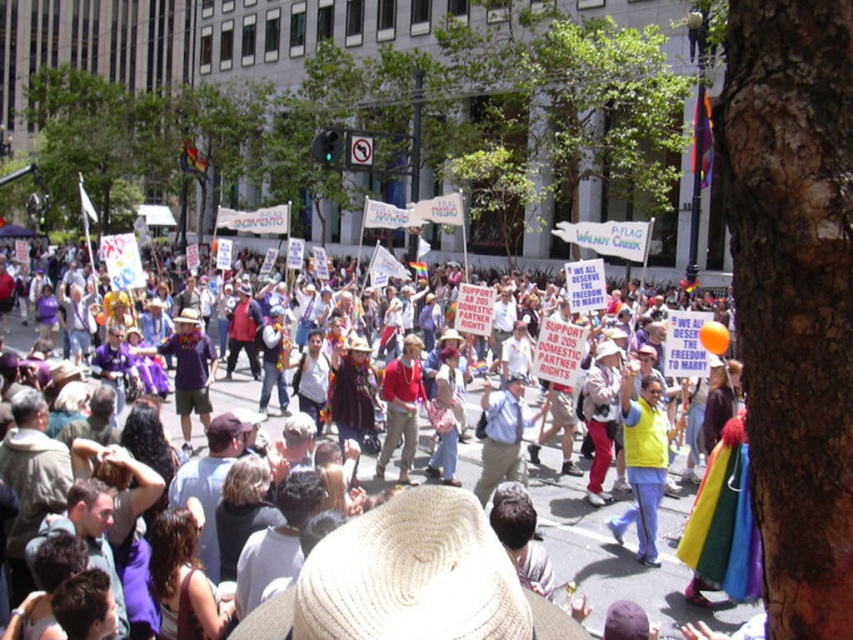
Question: Estimate the real-world distances between objects in this image. Which object is closer to the white cotton hat at center?

Choices:
 (A) red matte shirt at center
 (B) white straw cowboy hat at center

Answer: (A)

Question: Can you confirm if white straw cowboy hat at center is positioned above red matte shirt at center?

Choices:
 (A) yes
 (B) no

Answer: (B)

Question: Considering the real-world distances, which object is farthest from the red matte shirt at center?

Choices:
 (A) white straw cowboy hat at center
 (B) white cotton hat at center

Answer: (A)

Question: Can you confirm if white cotton hat at center is positioned to the right of red matte shirt at center?

Choices:
 (A) no
 (B) yes

Answer: (A)

Question: Which is farther from the red matte shirt at center?

Choices:
 (A) white cotton hat at center
 (B) white straw cowboy hat at center

Answer: (B)

Question: Can you confirm if white straw cowboy hat at center is positioned to the right of red matte shirt at center?

Choices:
 (A) no
 (B) yes

Answer: (B)